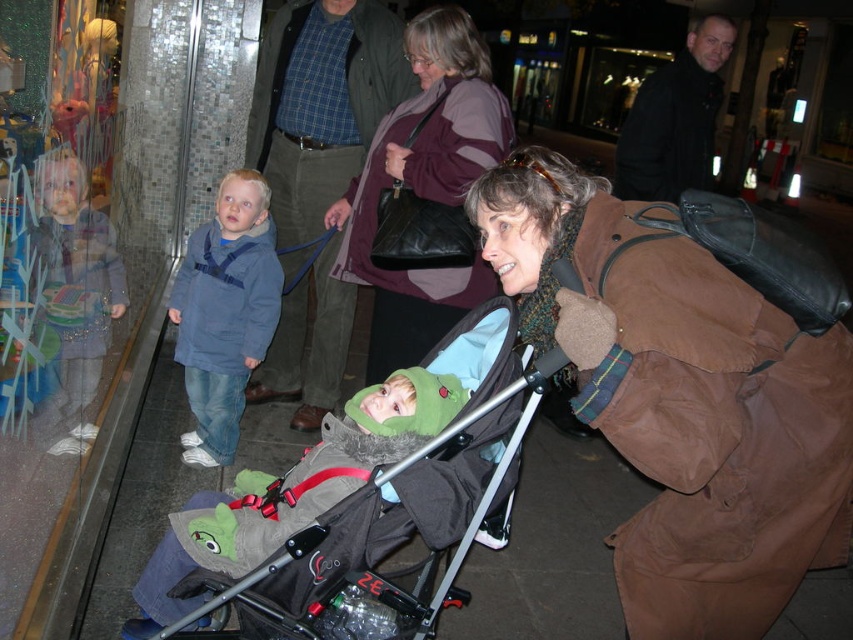
Can you confirm if maroon sweater at center is positioned to the right of denim jacket at left?

Correct, you'll find maroon sweater at center to the right of denim jacket at left.

Does maroon sweater at center lie in front of denim jacket at left?

Yes, maroon sweater at center is in front of denim jacket at left.

Does point (434, 93) come in front of point (257, 260)?

Yes.

Locate an element on the screen. maroon sweater at center is located at coordinates (424, 186).

Is brown leather jacket at center bigger than dark gray fabric stroller at center?

Correct, brown leather jacket at center is larger in size than dark gray fabric stroller at center.

Who is more forward, (283, 381) or (498, 474)?

Point (498, 474) is in front.

Is point (393, 42) behind point (363, 428)?

Yes.

Where is `brown leather jacket at center`? This screenshot has height=640, width=853. brown leather jacket at center is located at coordinates (321, 104).

The width and height of the screenshot is (853, 640). Find the location of `maroon sweater at center`. maroon sweater at center is located at coordinates (424, 186).

Identify the location of maroon sweater at center. The image size is (853, 640). (424, 186).